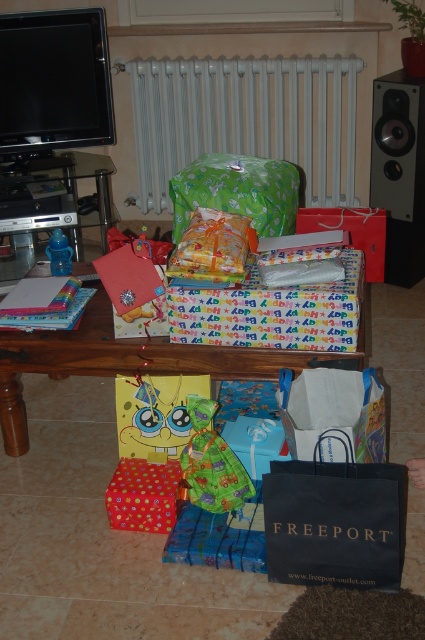
Does wooden table at center have a smaller size compared to polka dot paper gift at center?

No, wooden table at center is not smaller than polka dot paper gift at center.

Between point (113, 332) and point (138, 464), which one is positioned behind?

The point (138, 464) is behind.

The image size is (425, 640). I want to click on wooden table at center, so click(x=130, y=360).

How distant is white metallic radiator at upper center from black plastic speaker at upper right?

white metallic radiator at upper center is 24.28 inches from black plastic speaker at upper right.

Is white metallic radiator at upper center further to the viewer compared to black plastic speaker at upper right?

Yes, it is.

Where is `white metallic radiator at upper center`? The width and height of the screenshot is (425, 640). white metallic radiator at upper center is located at coordinates (246, 120).

Consider the image. Does wooden table at center have a lesser height compared to green fabric toy at center?

No, wooden table at center is not shorter than green fabric toy at center.

Is point (96, 316) less distant than point (197, 396)?

No, (96, 316) is further to viewer.

Where is `wooden table at center`? Image resolution: width=425 pixels, height=640 pixels. wooden table at center is located at coordinates (130, 360).